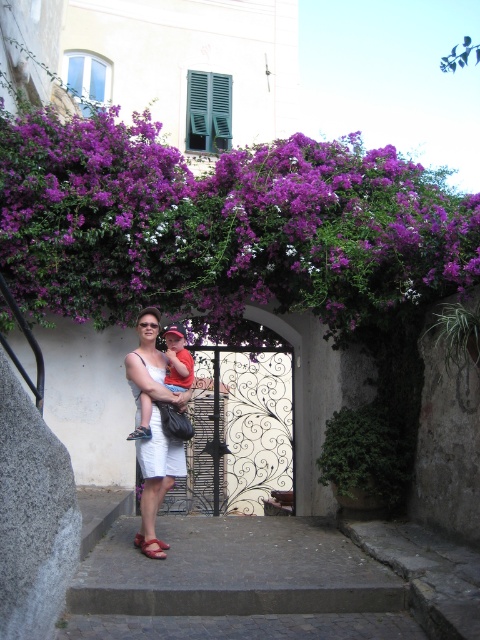
You are a tourist in the alleyway and want to take a photo of the purple matte flowers at upper center and the matte brown sandal at lower center. Which object should you focus on first if you want to capture both in the same frame without moving the camera?

The purple matte flowers at upper center are to the right of the matte brown sandal at lower center, so you should focus on the matte brown sandal at lower center first to ensure both are in the frame.

You are a photographer trying to capture the child in the image. Since the white cotton shorts at center and the matte red shirt at center are both on the child, which clothing item might appear larger in the photo due to their actual size differences?

The white cotton shorts at center might appear larger in the photo than the matte red shirt at center because the white cotton shorts at center might be wider than matte red shirt at center.